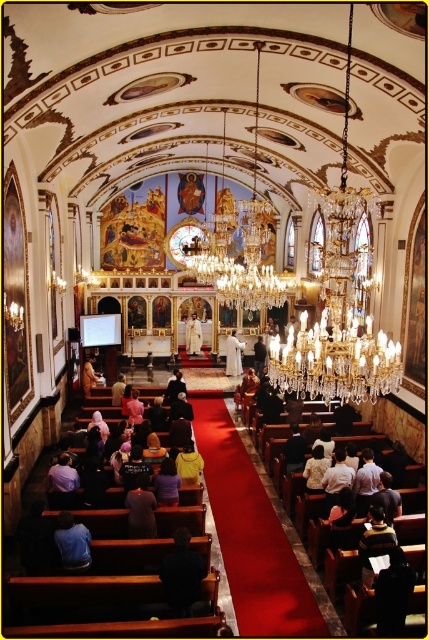
Is point (198, 344) closer to viewer compared to point (97, 378)?

No.

Which of these two, white clothed figure at center or wooden chair at lower left, stands shorter?

wooden chair at lower left is shorter.

Is point (187, 340) closer to viewer compared to point (90, 358)?

No, it is not.

This screenshot has height=640, width=429. Identify the location of white clothed figure at center. (193, 336).

Which is behind, point (135, 515) or point (97, 376)?

The point (97, 376) is more distant.

Is point (144, 500) closer to viewer compared to point (87, 390)?

Yes, point (144, 500) is closer to viewer.

Find the location of a particular element. The image size is (429, 640). dark brown shirt at center is located at coordinates (141, 508).

Between white clothed person at center and white clothed figure at center, which one appears on the right side from the viewer's perspective?

white clothed person at center is more to the right.

Is point (236, 353) behind point (187, 349)?

No.

Image resolution: width=429 pixels, height=640 pixels. Find the location of `white clothed person at center`. white clothed person at center is located at coordinates (233, 355).